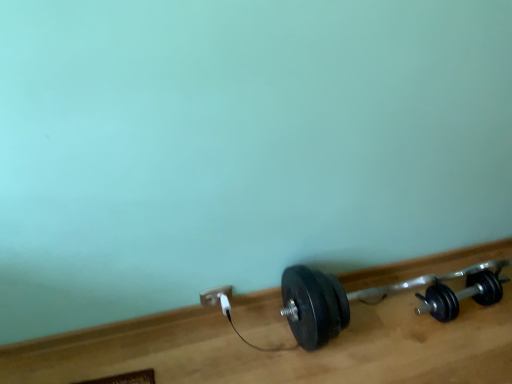
I want to click on vacant space in front of black rubber dumbbell at lower right, the 2th dumbbell positioned from the left, so click(466, 351).